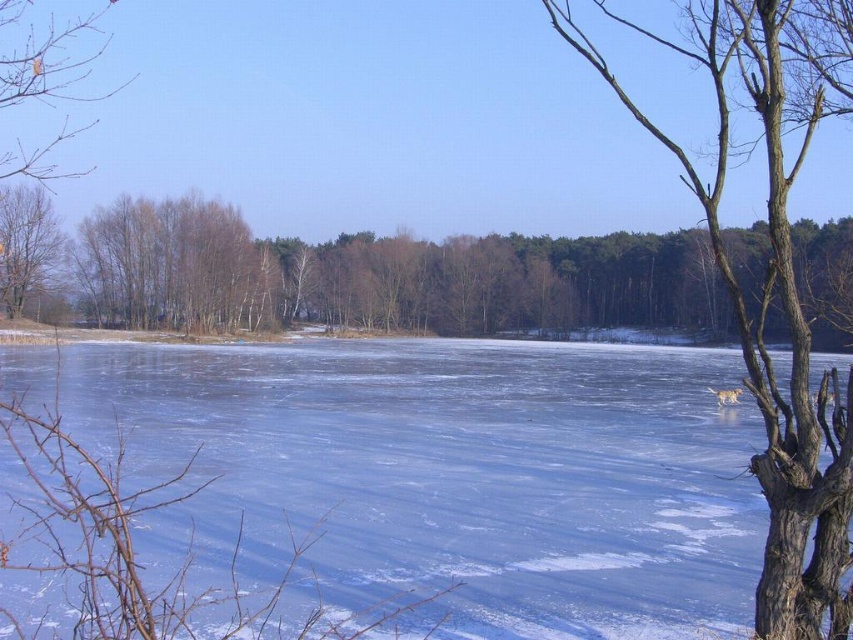
Question: Which of the following is the farthest from the observer?

Choices:
 (A) (12, 234)
 (B) (10, 168)
 (C) (210, 243)

Answer: (B)

Question: Considering the relative positions of brown bark tree at center and smooth brown tree trunk at left in the image provided, where is brown bark tree at center located with respect to smooth brown tree trunk at left?

Choices:
 (A) left
 (B) right

Answer: (B)

Question: Does smooth bark tree at right appear on the left side of brown leafless branch at upper left?

Choices:
 (A) no
 (B) yes

Answer: (A)

Question: Which point is closer to the camera?

Choices:
 (A) brown leafless branch at upper left
 (B) smooth brown tree trunk at left
 (C) brown bark tree at center

Answer: (C)

Question: Does smooth bark tree at right have a greater width compared to brown leafless branch at upper left?

Choices:
 (A) yes
 (B) no

Answer: (B)

Question: Which point is farther from the camera taking this photo?

Choices:
 (A) (59, 67)
 (B) (732, 241)
 (C) (142, 464)

Answer: (A)